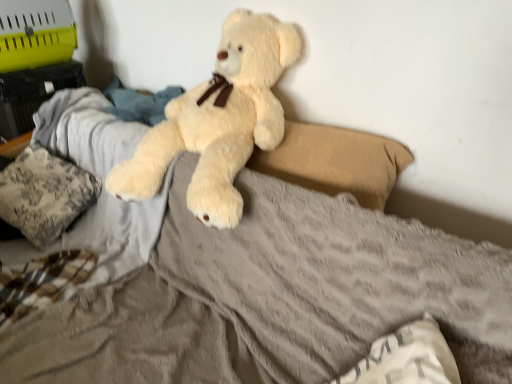
Question: Is white soft pillow at lower right, which is the 1th pillow in right-to-left order, to the left or to the right of fluffy fabric pillow at left, which appears as the 3th pillow when viewed from the right, in the image?

Choices:
 (A) right
 (B) left

Answer: (A)

Question: Considering their positions, is white soft pillow at lower right, which is the 1th pillow in right-to-left order, located in front of or behind fluffy fabric pillow at left, which ranks as the first pillow in left-to-right order?

Choices:
 (A) front
 (B) behind

Answer: (A)

Question: Which object is positioned closest to the fluffy fabric pillow at left, acting as the 1th pillow starting from the back?

Choices:
 (A) beige fabric pillow at center, the second pillow when ordered from back to front
 (B) fluffy beige teddy bear at center
 (C) white soft pillow at lower right, arranged as the 3th pillow when viewed from the left

Answer: (B)

Question: Based on their relative distances, which object is farther from the fluffy fabric pillow at left, which ranks as the first pillow in left-to-right order?

Choices:
 (A) white soft pillow at lower right, which is the 1th pillow in right-to-left order
 (B) beige fabric pillow at center, the second pillow when ordered from back to front
 (C) fluffy beige teddy bear at center

Answer: (A)